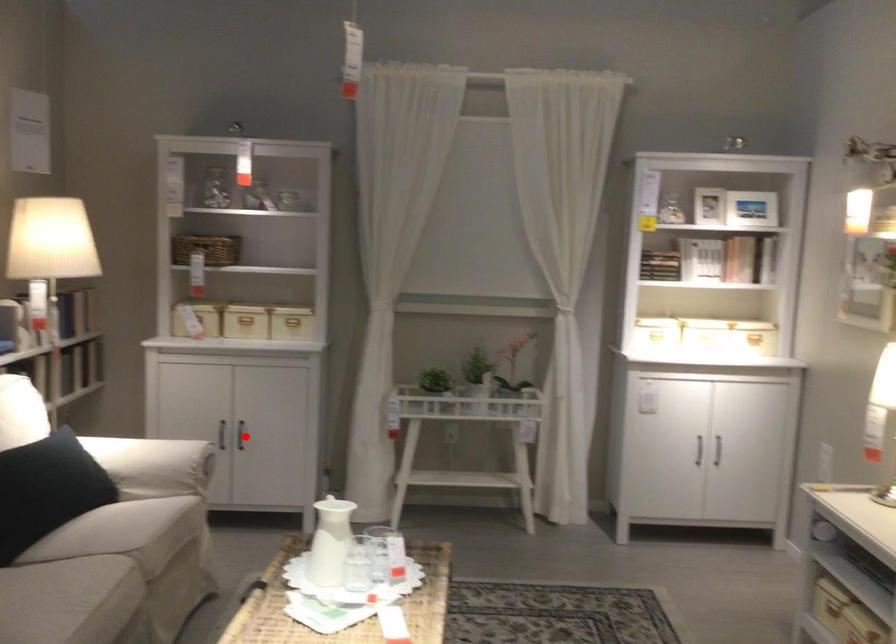
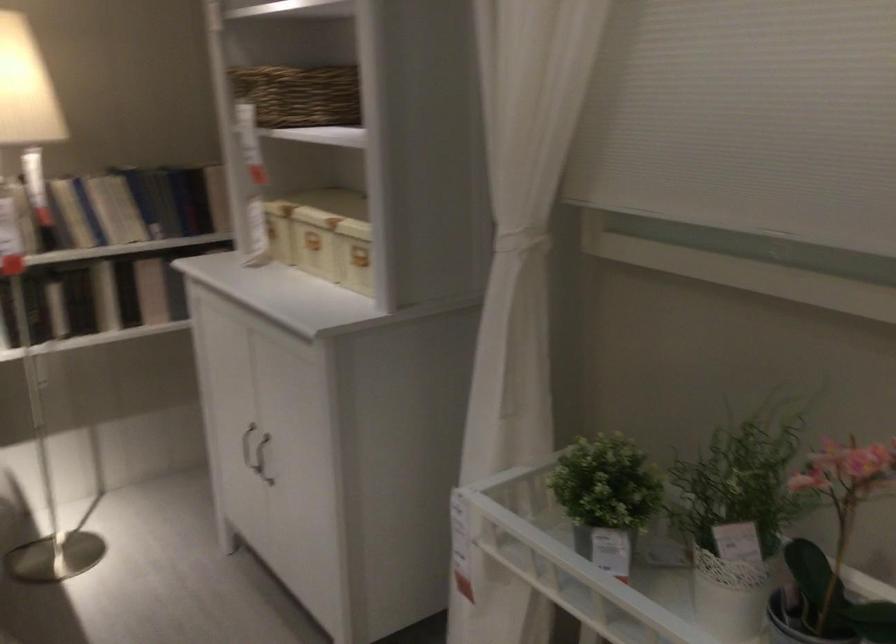
Question: I am providing you with two images of the same scene from different viewpoints. A red point is marked on the first image. Can you still see the location of the red point in image 2?

Choices:
 (A) Yes
 (B) No

Answer: (A)